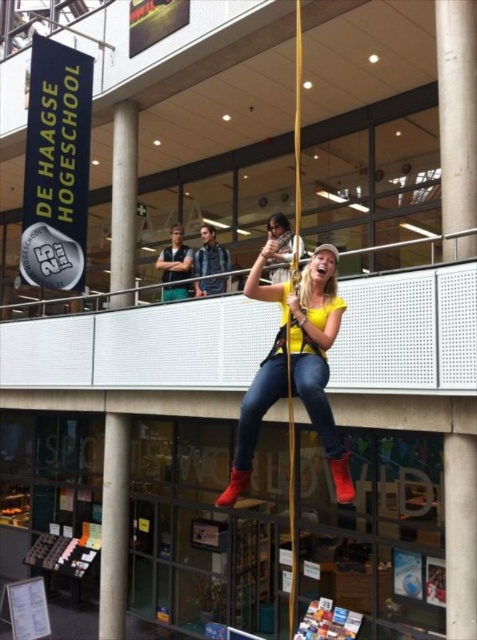
Which is above, denim jacket at center or matte blue jeans at center?

matte blue jeans at center

Which is behind, point (229, 264) or point (178, 269)?

Point (178, 269)

Where is `denim jacket at center`? The image size is (477, 640). denim jacket at center is located at coordinates (210, 253).

Locate an element on the screen. The image size is (477, 640). denim jacket at center is located at coordinates (210, 253).

Which is above, yellow matte/yellowish-green fabric at center or matte blue jeans at center?

matte blue jeans at center is higher up.

Does point (248, 396) lie in front of point (189, 275)?

That is True.

The height and width of the screenshot is (640, 477). In order to click on yellow matte/yellowish-green fabric at center in this screenshot , I will do `click(294, 364)`.

Which is in front, point (238, 496) or point (201, 275)?

Point (238, 496) is in front.

Does yellow matte/yellowish-green fabric at center have a greater height compared to denim jacket at center?

Yes, yellow matte/yellowish-green fabric at center is taller than denim jacket at center.

This screenshot has width=477, height=640. In order to click on yellow matte/yellowish-green fabric at center in this screenshot , I will do `click(294, 364)`.